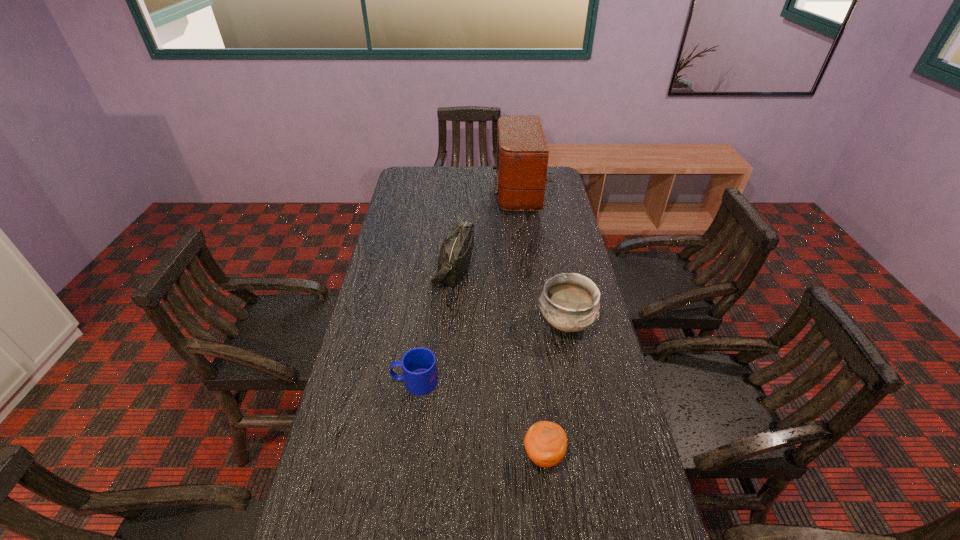
Locate an element on the screen. This screenshot has height=540, width=960. free space in the image that satisfies the following two spatial constraints: 1. at the front padded panel of the shoulder bag; 2. on the back side of the pottery is located at coordinates (449, 323).